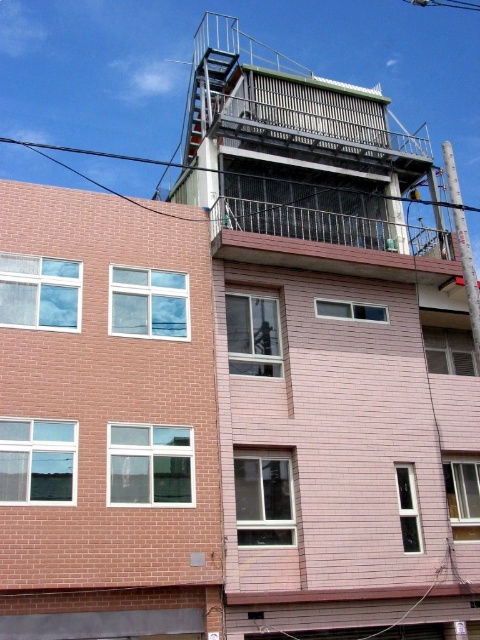
Question: Among these objects, which one is nearest to the camera?

Choices:
 (A) black wire at upper left
 (B) brown textured balcony at upper center

Answer: (B)

Question: Can you confirm if brown textured balcony at upper center is positioned above black wire at upper left?

Choices:
 (A) yes
 (B) no

Answer: (B)

Question: Which of the following is the farthest from the observer?

Choices:
 (A) (119, 157)
 (B) (312, 256)

Answer: (A)

Question: Can you confirm if brown textured balcony at upper center is positioned to the left of black wire at upper left?

Choices:
 (A) no
 (B) yes

Answer: (B)

Question: Which point appears farthest from the camera in this image?

Choices:
 (A) (359, 218)
 (B) (458, 208)

Answer: (A)

Question: Is brown textured balcony at upper center above black wire at upper left?

Choices:
 (A) yes
 (B) no

Answer: (B)